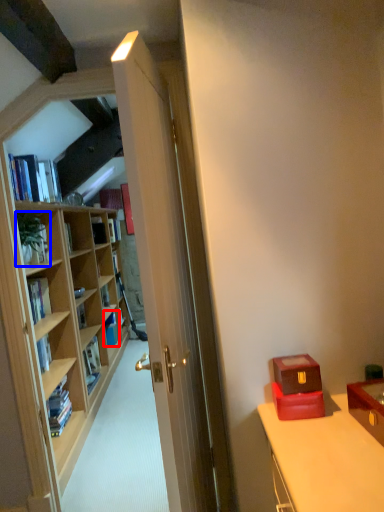
Question: Which object is closer to the camera taking this photo, book (highlighted by a red box) or houseplant (highlighted by a blue box)?

Choices:
 (A) book
 (B) houseplant

Answer: (B)